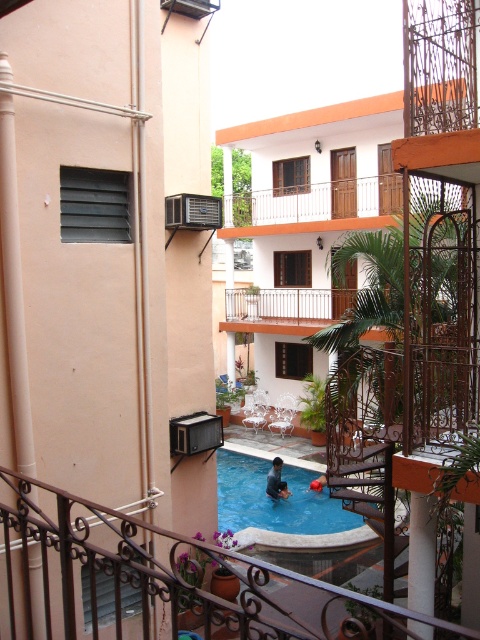
Question: Estimate the real-world distances between objects in this image. Which object is closer to the white wooden balcony at upper center?

Choices:
 (A) black wrought iron railing at lower center
 (B) blue glossy pool at center
 (C) white wood balcony at upper center

Answer: (C)

Question: Which object is positioned closest to the white wooden balcony at upper center?

Choices:
 (A) blue glossy pool at center
 (B) black wrought iron railing at lower center
 (C) matte black air conditioner at left

Answer: (A)

Question: Which of these objects is positioned farthest from the white marble pillar at lower right?

Choices:
 (A) matte black air conditioner at left
 (B) white wooden balcony at upper center
 (C) blue glossy pool at center

Answer: (B)

Question: Is blue glossy pool at center smaller than white wooden balcony at upper center?

Choices:
 (A) no
 (B) yes

Answer: (B)

Question: Can you confirm if black wrought iron railing at lower center is thinner than white wooden balcony at upper center?

Choices:
 (A) no
 (B) yes

Answer: (B)

Question: Considering the relative positions of blue glossy pool at center and white wooden balcony at upper center in the image provided, where is blue glossy pool at center located with respect to white wooden balcony at upper center?

Choices:
 (A) left
 (B) right

Answer: (A)